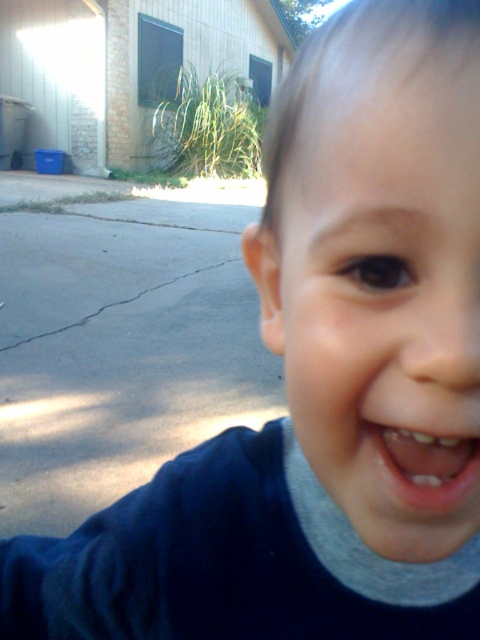
Question: Is smooth skin face at center above pink flesh-colored mouth at lower center?

Choices:
 (A) no
 (B) yes

Answer: (B)

Question: Which point is farther to the camera?

Choices:
 (A) (343, 296)
 (B) (386, 433)

Answer: (B)

Question: Which object appears farthest from the camera in this image?

Choices:
 (A) smooth skin face at center
 (B) pink flesh-colored mouth at lower center

Answer: (B)

Question: Is smooth skin face at center in front of pink flesh-colored mouth at lower center?

Choices:
 (A) yes
 (B) no

Answer: (A)

Question: Which object appears closest to the camera in this image?

Choices:
 (A) smooth skin face at center
 (B) pink flesh-colored mouth at lower center

Answer: (A)

Question: Considering the relative positions of smooth skin face at center and pink flesh-colored mouth at lower center in the image provided, where is smooth skin face at center located with respect to pink flesh-colored mouth at lower center?

Choices:
 (A) right
 (B) left

Answer: (B)